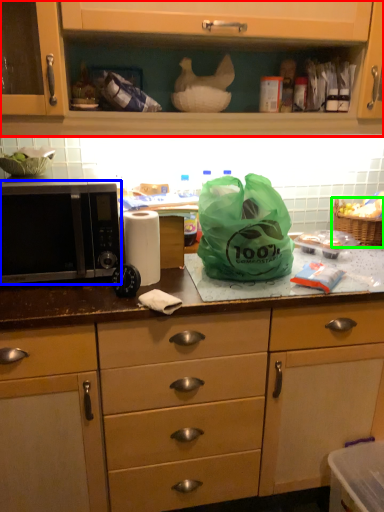
Question: Which object is positioned farthest from cabinetry (highlighted by a red box)? Select from microwave oven (highlighted by a blue box) and picnic basket (highlighted by a green box).

Choices:
 (A) microwave oven
 (B) picnic basket

Answer: (B)